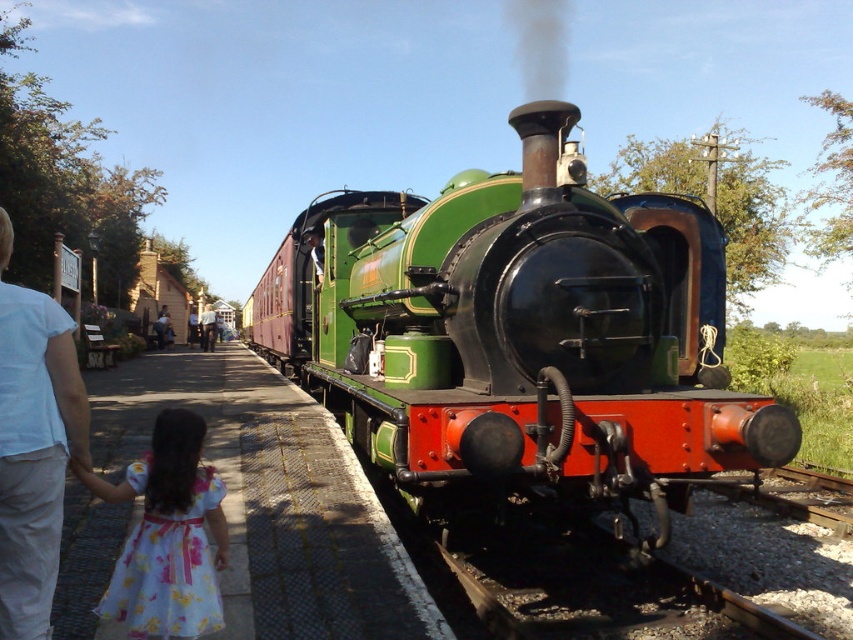
Question: Does white cotton shirt at left appear under floral cotton dress at lower left?

Choices:
 (A) yes
 (B) no

Answer: (B)

Question: Can you confirm if smoketransparent at center is bigger than light brown wooden sign at center?

Choices:
 (A) no
 (B) yes

Answer: (A)

Question: Considering the real-world distances, which object is farthest from the light brown wooden sign at center?

Choices:
 (A) white cotton shirt at left
 (B) green polished wood train at center
 (C) floral cotton dress at lower left

Answer: (A)

Question: Is smoketransparent at center bigger than light brown wooden sign at center?

Choices:
 (A) no
 (B) yes

Answer: (A)

Question: Which object is closer to the camera taking this photo?

Choices:
 (A) light brown wooden sign at center
 (B) white cotton shirt at left
 (C) green polished wood train at center
 (D) floral cotton dress at lower left

Answer: (B)

Question: Which point is farther to the camera?

Choices:
 (A) light brown wooden sign at center
 (B) floral cotton dress at lower left
 (C) green polished wood train at center

Answer: (A)